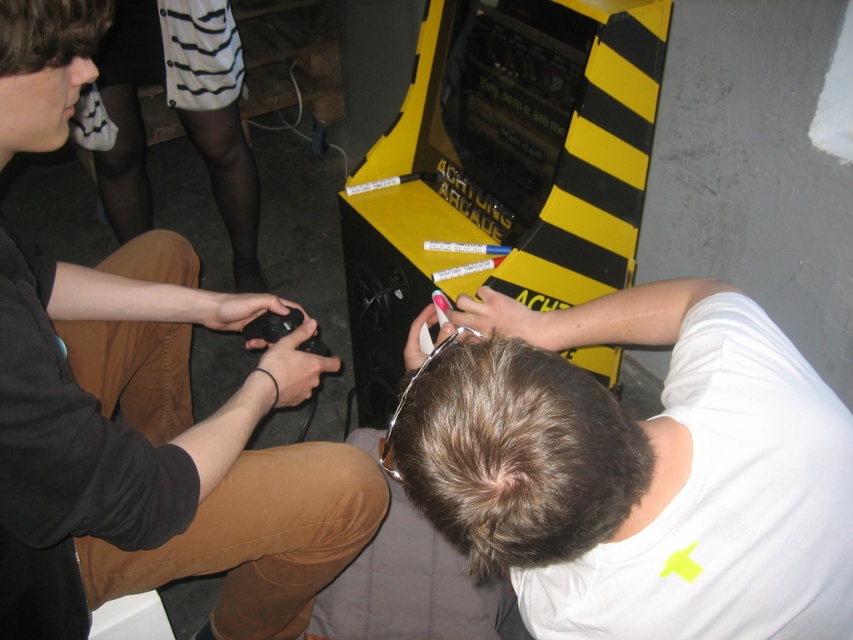
Question: Is dark brown hair at center further to the viewer compared to dark brown hair at upper left?

Choices:
 (A) no
 (B) yes

Answer: (A)

Question: Does white matte shirt at lower right appear on the left side of dark brown hair at center?

Choices:
 (A) yes
 (B) no

Answer: (B)

Question: In this image, where is dark brown hair at center located relative to dark brown hair at upper left?

Choices:
 (A) left
 (B) right

Answer: (B)

Question: Which object is farther from the camera taking this photo?

Choices:
 (A) dark brown hair at center
 (B) dark brown hair at upper left
 (C) black matte controller at lower left
 (D) white matte shirt at lower right

Answer: (C)

Question: Which of the following is the closest to the observer?

Choices:
 (A) click(843, 419)
 (B) click(39, 324)

Answer: (B)

Question: Which point is closer to the camera taking this photo?

Choices:
 (A) (47, 472)
 (B) (93, 26)
 (C) (425, 406)

Answer: (C)